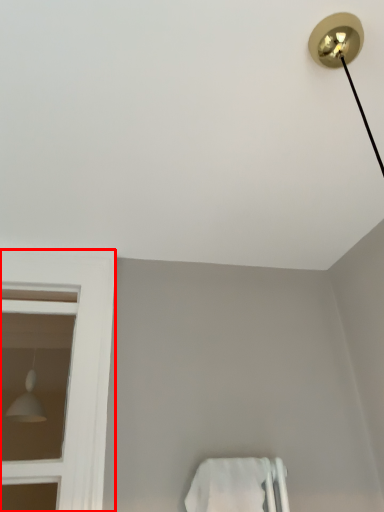
Question: From the image's perspective, what is the correct spatial relationship of bay window (annotated by the red box) in relation to towel bar?

Choices:
 (A) below
 (B) above

Answer: (B)